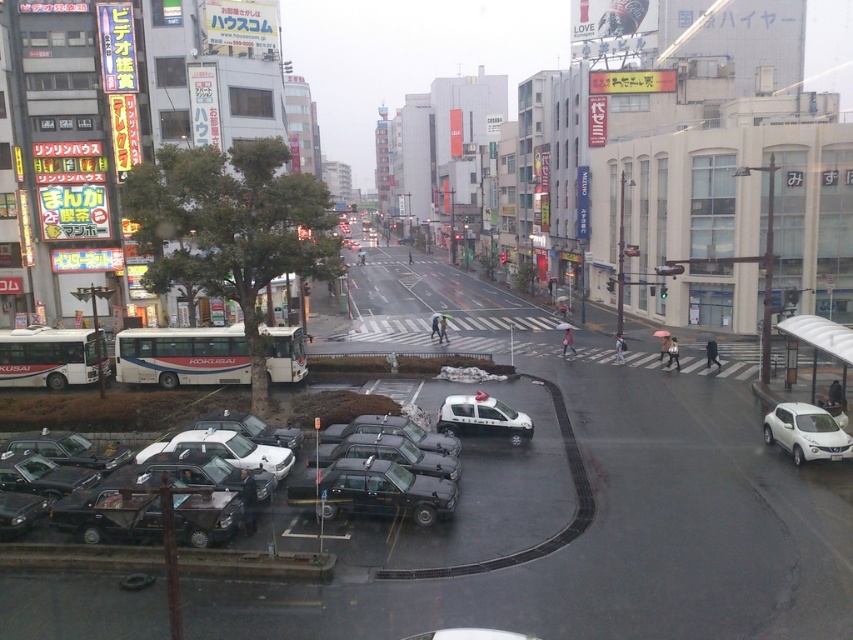
You are a delivery person who needs to load a tall package into one of the vehicles. Based on the image, which vehicle between the black rubber taxi at lower left and the white glossy car at center would be better suited for the task?

The black rubber taxi at lower left is taller than the white glossy car at center, so it would be better suited for loading a tall package.